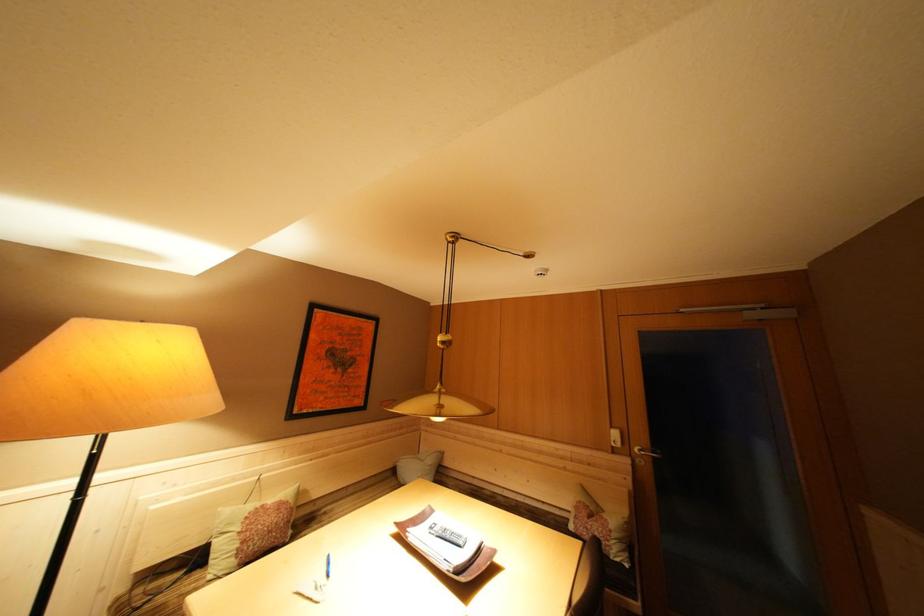
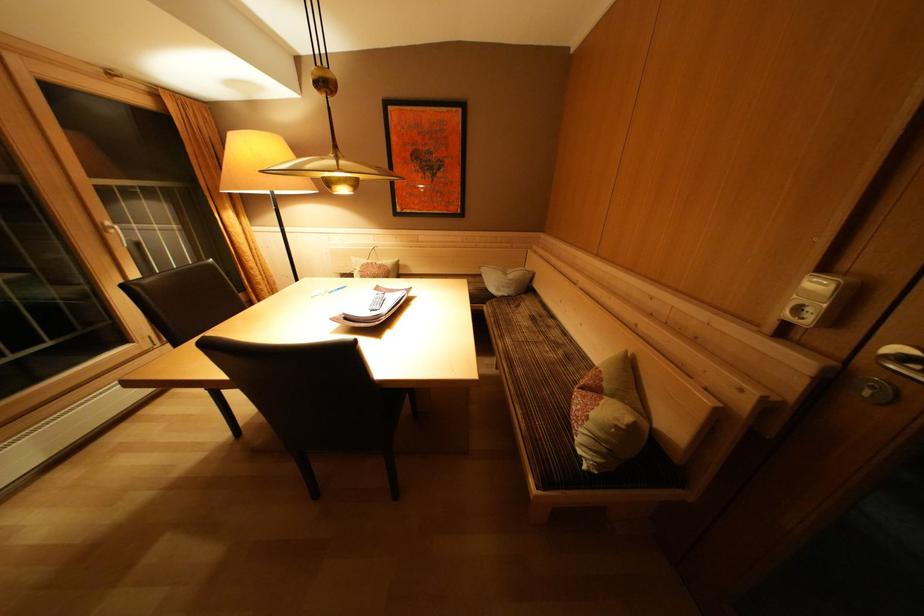
The point at (618, 532) is marked in the first image. Where is the corresponding point in the second image?

(600, 419)